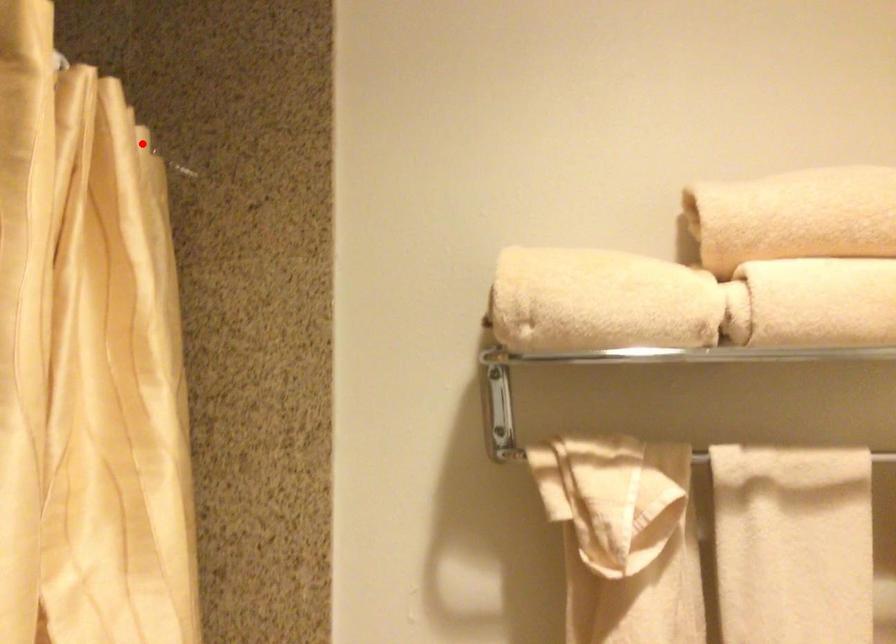
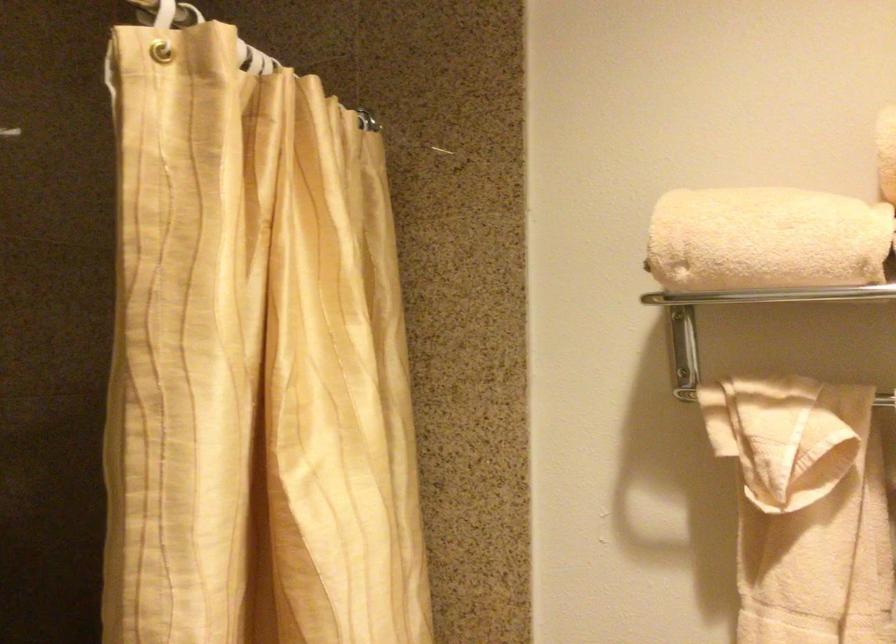
Question: I am providing you with two images of the same scene from different viewpoints. A red point is shown in image1. For the corresponding object point in image2, is it positioned nearer or farther from the camera?

Choices:
 (A) Nearer
 (B) Farther

Answer: (B)